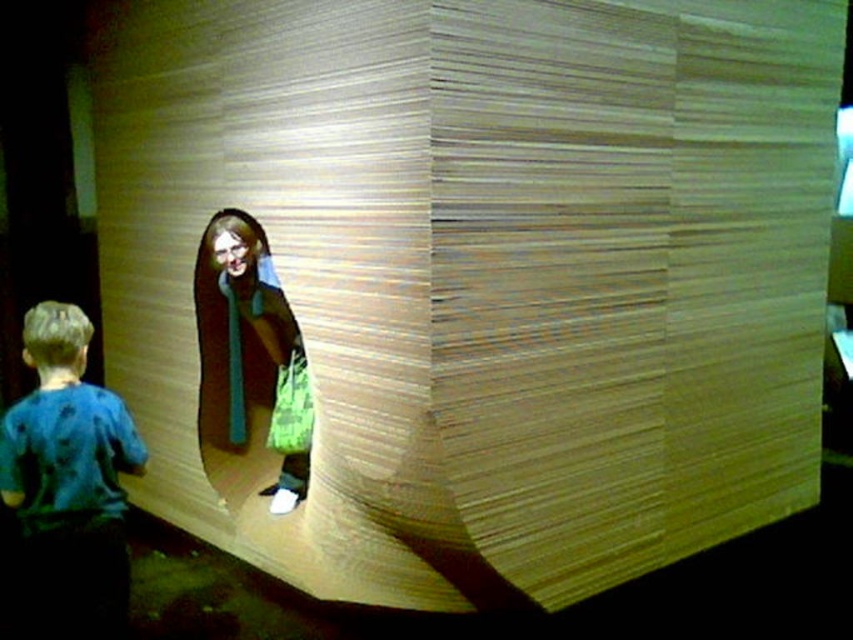
Which is in front, point (201, 275) or point (273, 420)?

Positioned in front is point (273, 420).

Locate an element on the screen. The height and width of the screenshot is (640, 853). matte brown coat at center is located at coordinates (242, 316).

Is point (224, 336) positioned behind point (297, 404)?

Yes, point (224, 336) is farther from viewer.

At what (x,y) coordinates should I click in order to perform the action: click on matte brown coat at center. Please return your answer as a coordinate pair (x, y). Looking at the image, I should click on (242, 316).

Is point (4, 419) farther from camera compared to point (277, 371)?

No, (4, 419) is in front of (277, 371).

The width and height of the screenshot is (853, 640). What do you see at coordinates (70, 477) in the screenshot? I see `blue fabric shirt at lower left` at bounding box center [70, 477].

The height and width of the screenshot is (640, 853). In order to click on blue fabric shirt at lower left in this screenshot , I will do `click(70, 477)`.

Between point (119, 554) and point (291, 484), which one is positioned behind?

Positioned behind is point (291, 484).

Does blue fabric shirt at lower left lie in front of matte brown coat at center?

Yes.

Identify the location of blue fabric shirt at lower left. (70, 477).

This screenshot has width=853, height=640. Find the location of `blue fabric shirt at lower left`. blue fabric shirt at lower left is located at coordinates (70, 477).